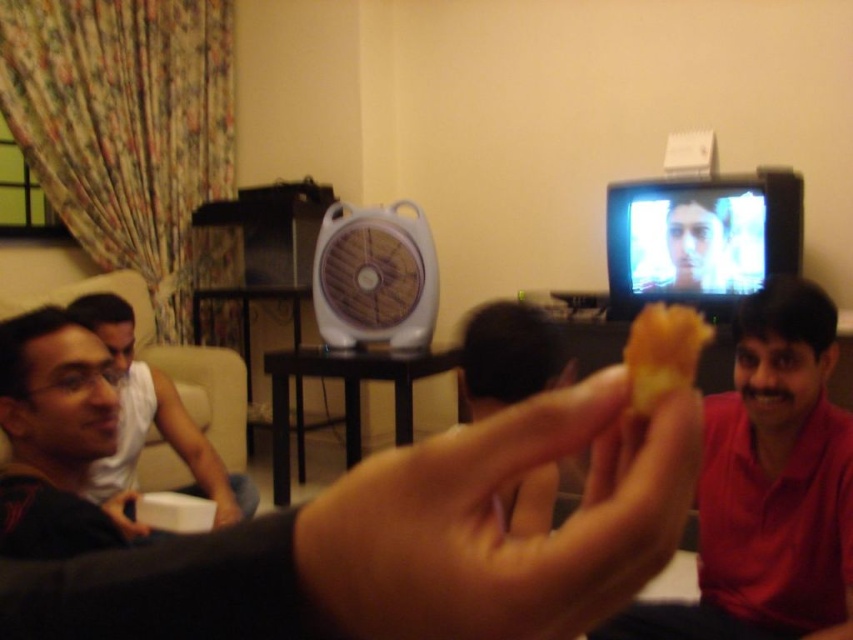
Question: Is matte white shirt at left bigger than brown matte bread at center?

Choices:
 (A) no
 (B) yes

Answer: (B)

Question: Which object appears farthest from the camera in this image?

Choices:
 (A) white plastic fan at center
 (B) matte white shirt at left
 (C) brown matte bread at center
 (D) skinny yellow bread at center

Answer: (A)

Question: Is white plastic fan at center positioned at the back of brown leather hand at center?

Choices:
 (A) no
 (B) yes

Answer: (B)

Question: Is red matte shirt at right further to the viewer compared to matte white shirt at left?

Choices:
 (A) yes
 (B) no

Answer: (B)

Question: Estimate the real-world distances between objects in this image. Which object is farther from the red matte shirt at right?

Choices:
 (A) matte white shirt at left
 (B) yellow matte snack at center
 (C) white plastic fan at center
 (D) brown leather hand at center

Answer: (C)

Question: Based on their relative distances, which object is farther from the brown matte bread at center?

Choices:
 (A) brown leather hand at center
 (B) white plastic fan at center
 (C) smooth skin face at upper center
 (D) matte black hand at center

Answer: (C)